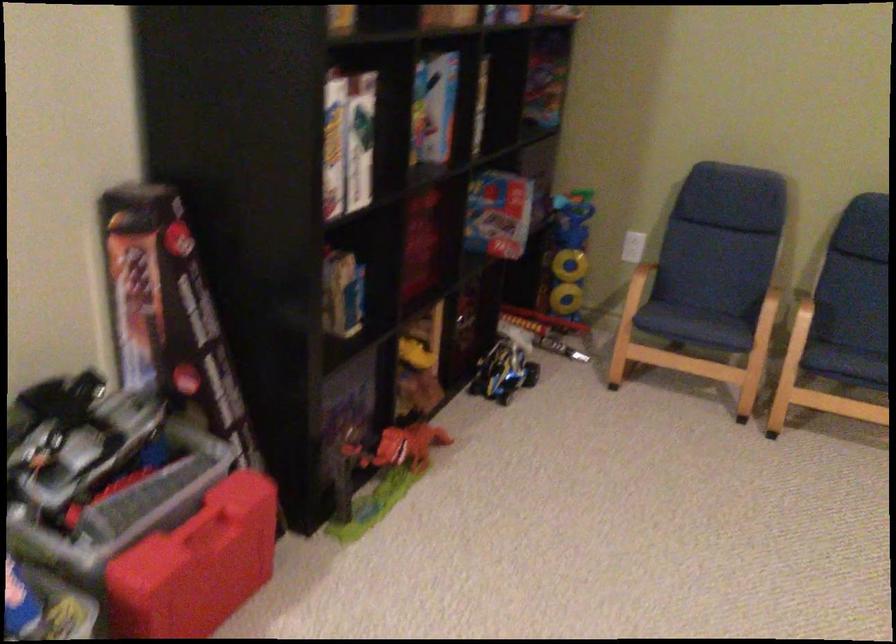
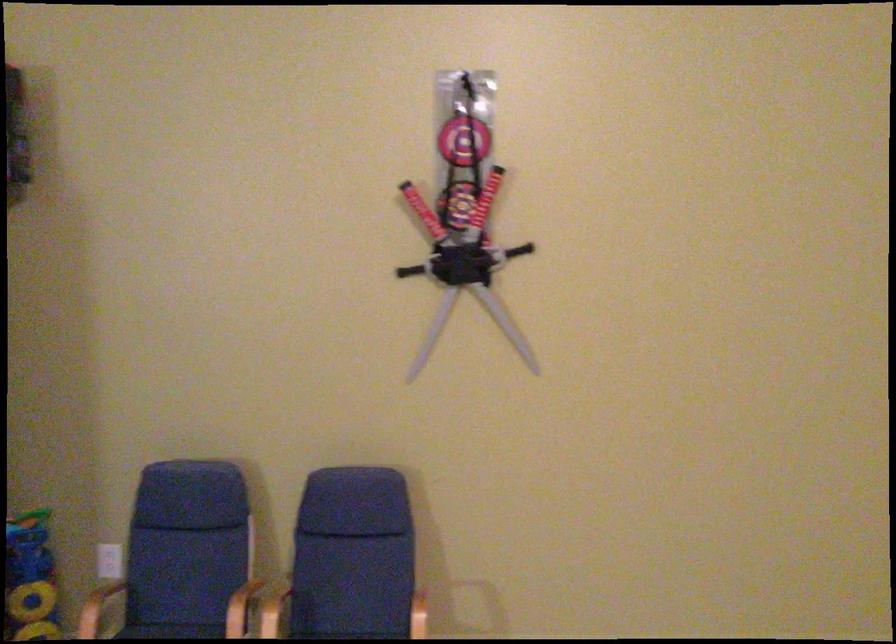
The point at (694, 308) is marked in the first image. Where is the corresponding point in the second image?

(169, 630)